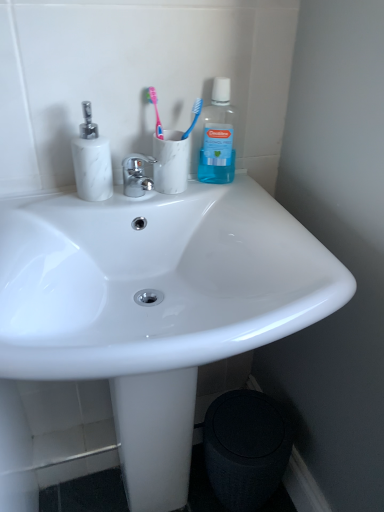
Where is `vacant area that is situated to the right of chrome/metallic faucet at center`? The width and height of the screenshot is (384, 512). vacant area that is situated to the right of chrome/metallic faucet at center is located at coordinates (210, 192).